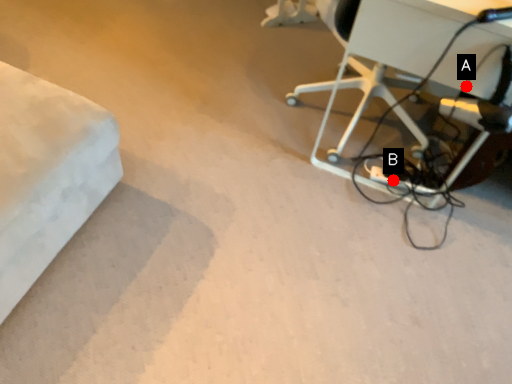
Question: Two points are circled on the image, labeled by A and B beside each circle. Which point is closer to the camera taking this photo?

Choices:
 (A) A is closer
 (B) B is closer

Answer: (A)